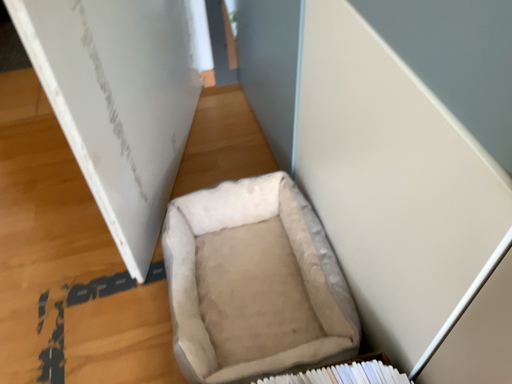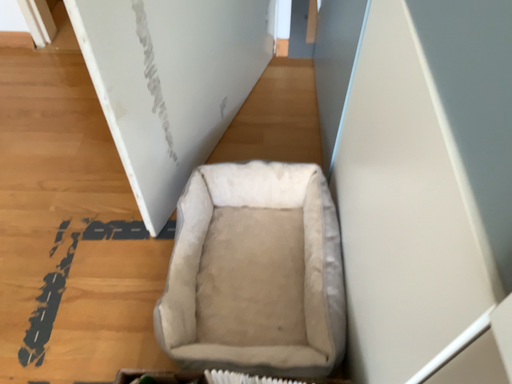
Question: Which way did the camera rotate in the video?

Choices:
 (A) rotated left
 (B) rotated right

Answer: (A)